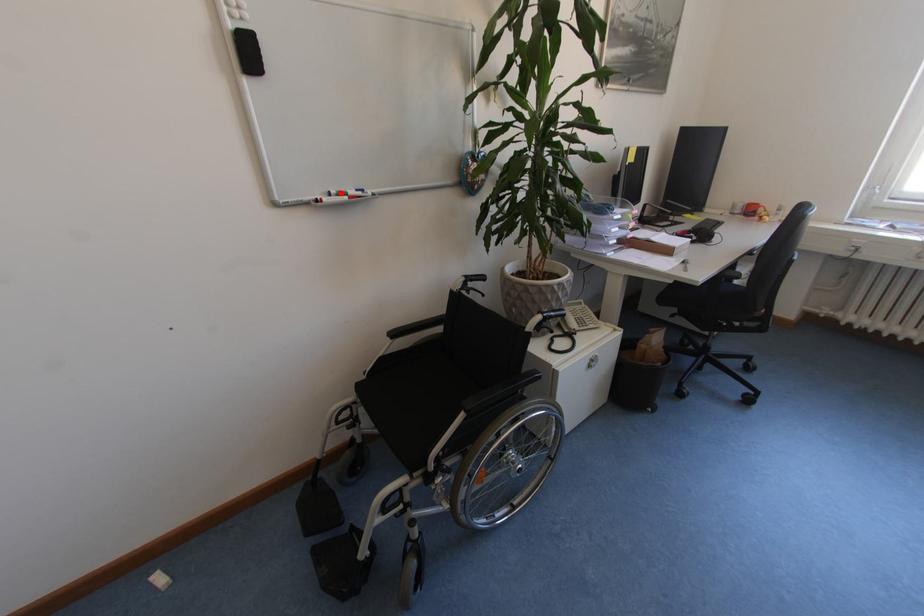
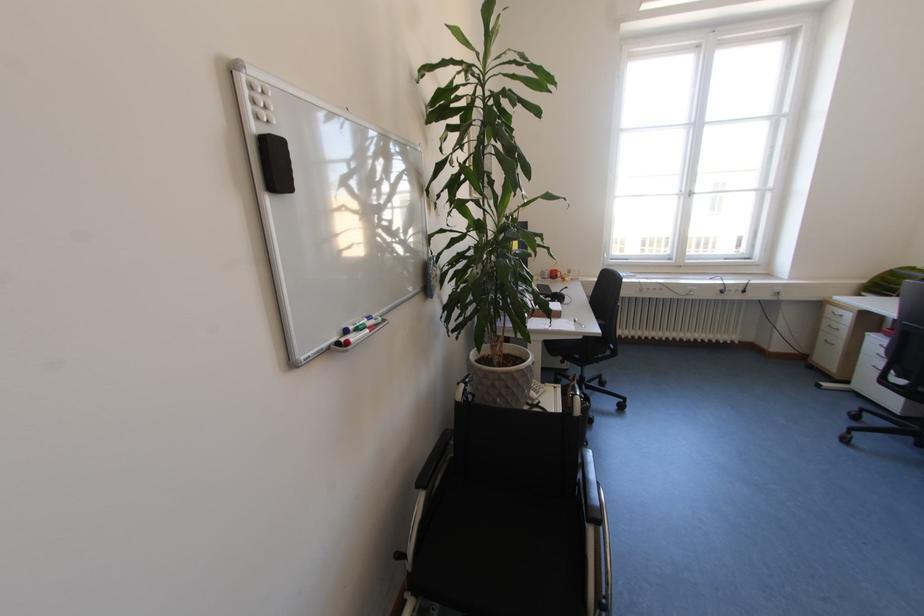
Where in the second image is the point corresponding to the highlighted location from the first image?

(359, 329)